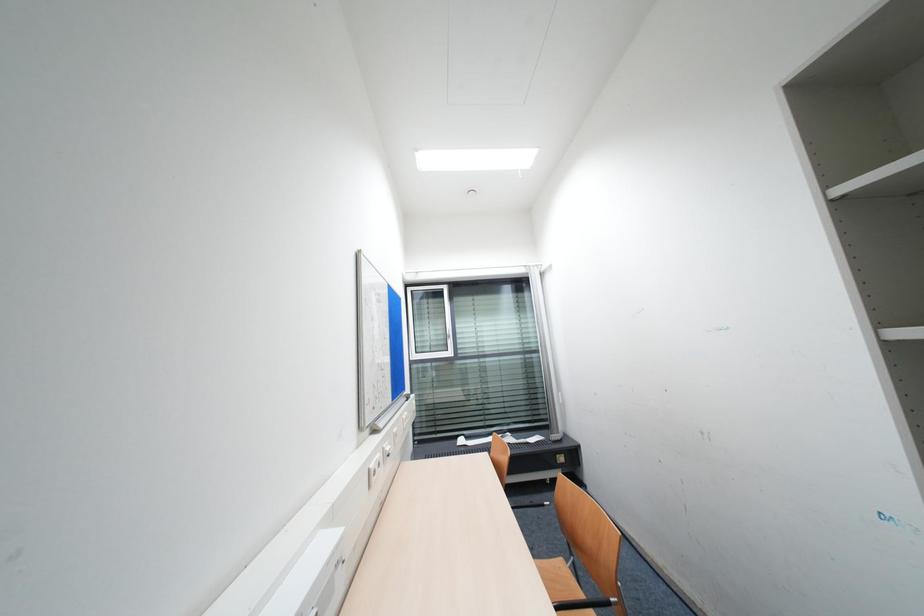
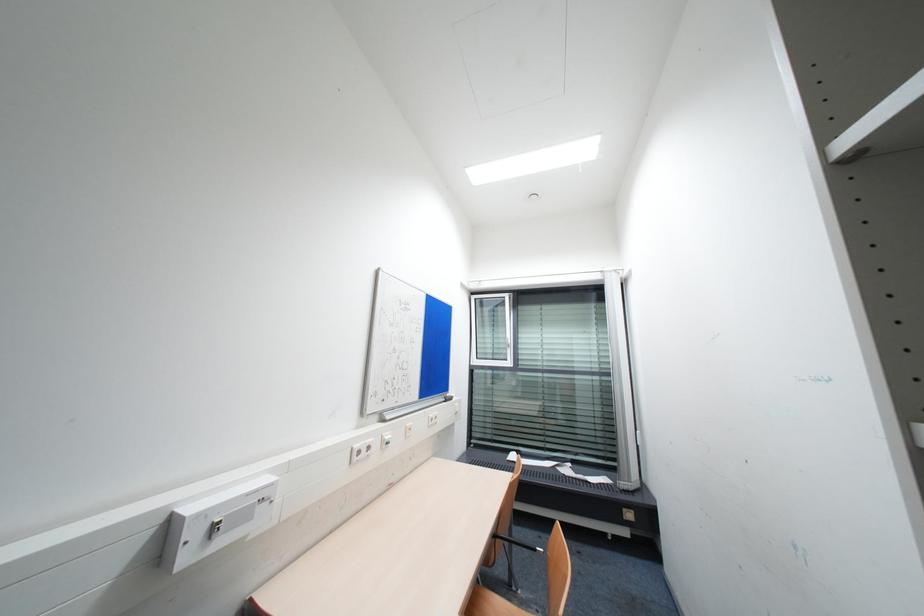
Question: The camera is either moving clockwise (left) or counter-clockwise (right) around the object. The first image is from the beginning of the video and the second image is from the end. Is the camera moving left or right when shooting the video?

Choices:
 (A) Left
 (B) Right

Answer: (B)